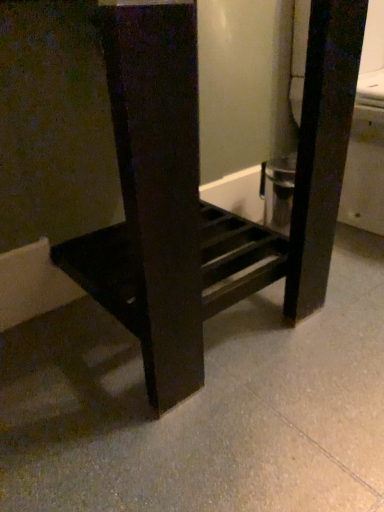
Question: Should I look upward or downward to see matte black shelf at lower center?

Choices:
 (A) up
 (B) down

Answer: (A)